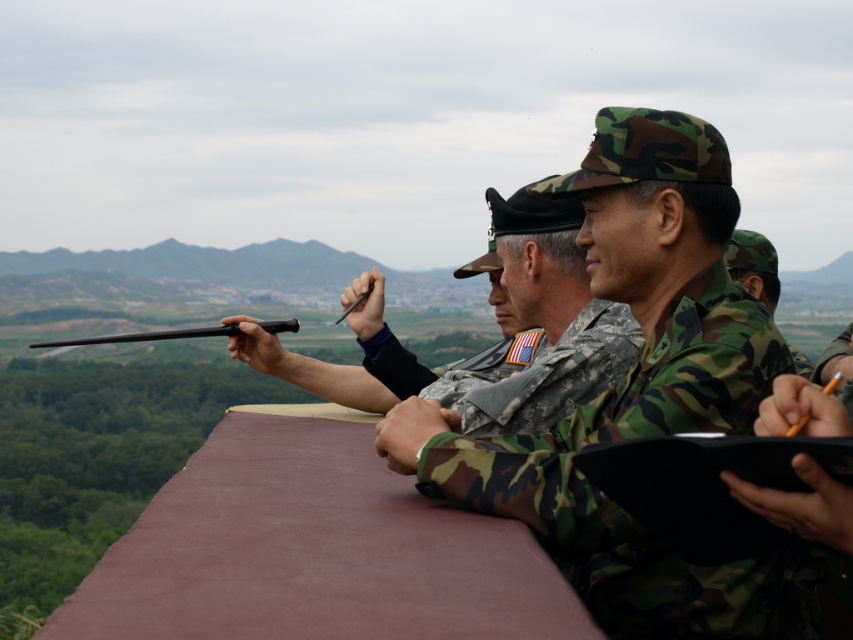
Based on the photo, between camo fabric uniform at center and camo uniform at center, which one appears on the left side from the viewer's perspective?

Positioned to the left is camo fabric uniform at center.

Between point (467, 456) and point (724, 250), which one is positioned behind?

Point (724, 250)

Find the location of a particular element. camo fabric uniform at center is located at coordinates (637, 392).

The image size is (853, 640). What do you see at coordinates (637, 392) in the screenshot?
I see `camo fabric uniform at center` at bounding box center [637, 392].

Between camo fabric uniform at center and black matte gun at center, which one has more height?

camo fabric uniform at center

Locate an element on the screen. The image size is (853, 640). camo fabric uniform at center is located at coordinates (637, 392).

Which of these two, camo uniform at center or black matte gun at center, stands shorter?

With less height is black matte gun at center.

Can you confirm if camo uniform at center is taller than black matte gun at center?

Indeed, camo uniform at center has a greater height compared to black matte gun at center.

Locate an element on the screen. This screenshot has height=640, width=853. camo uniform at center is located at coordinates (753, 266).